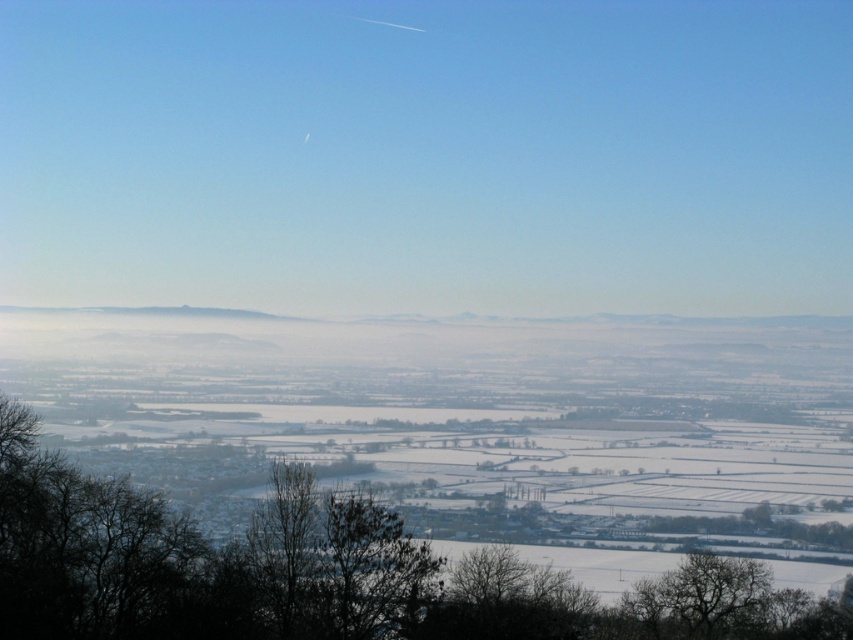
Question: Can you confirm if silhouette bare tree at lower center is positioned above bare branches at lower right?

Choices:
 (A) yes
 (B) no

Answer: (A)

Question: Which object appears farthest from the camera in this image?

Choices:
 (A) silhouette bare tree at lower center
 (B) bare branches at lower right

Answer: (B)

Question: Does silhouette bare tree at lower center lie behind bare branches at lower right?

Choices:
 (A) no
 (B) yes

Answer: (A)

Question: Is silhouette bare tree at lower center to the right of bare branches at lower right from the viewer's perspective?

Choices:
 (A) no
 (B) yes

Answer: (A)